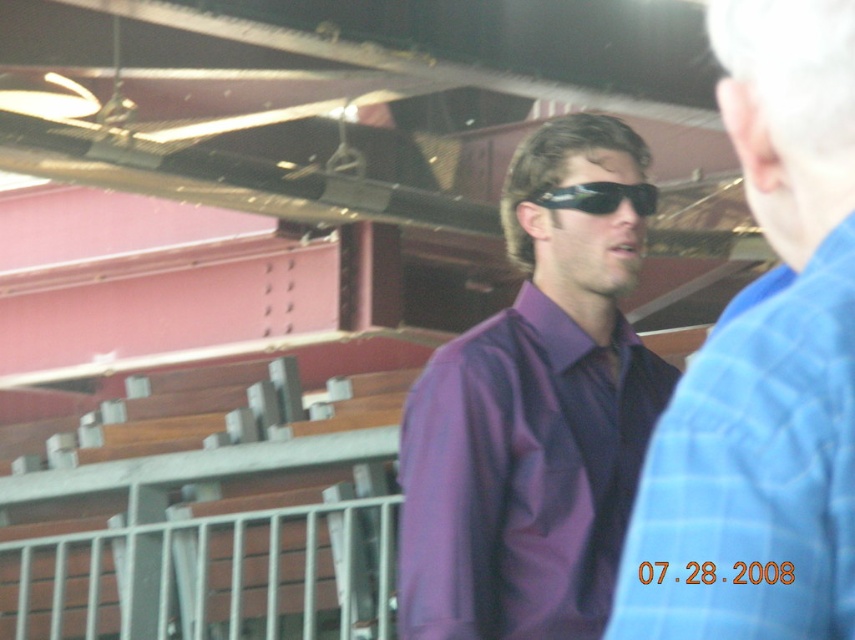
What do you see at coordinates (534, 416) in the screenshot?
I see `purple smooth shirt at center` at bounding box center [534, 416].

You are a GUI agent. You are given a task and a screenshot of the screen. Output one action in this format:
    pyautogui.click(x=<x>, y=<y>)
    Task: Click on the purple smooth shirt at center
    The width and height of the screenshot is (855, 640).
    Given the screenshot: What is the action you would take?
    pyautogui.click(x=534, y=416)

Is purple shiny shirt at center smaller than sunglasses at center?

No.

Is purple shiny shirt at center to the left of sunglasses at center from the viewer's perspective?

Incorrect, purple shiny shirt at center is not on the left side of sunglasses at center.

Is point (852, 426) positioned after point (587, 205)?

No, (852, 426) is in front of (587, 205).

This screenshot has height=640, width=855. I want to click on purple shiny shirt at center, so click(x=764, y=365).

Which is more to the right, purple shiny shirt at center or purple smooth shirt at center?

purple shiny shirt at center is more to the right.

Between point (797, 532) and point (504, 436), which one is positioned in front?

Point (797, 532) is more forward.

Where is `purple shiny shirt at center`? Image resolution: width=855 pixels, height=640 pixels. purple shiny shirt at center is located at coordinates (764, 365).